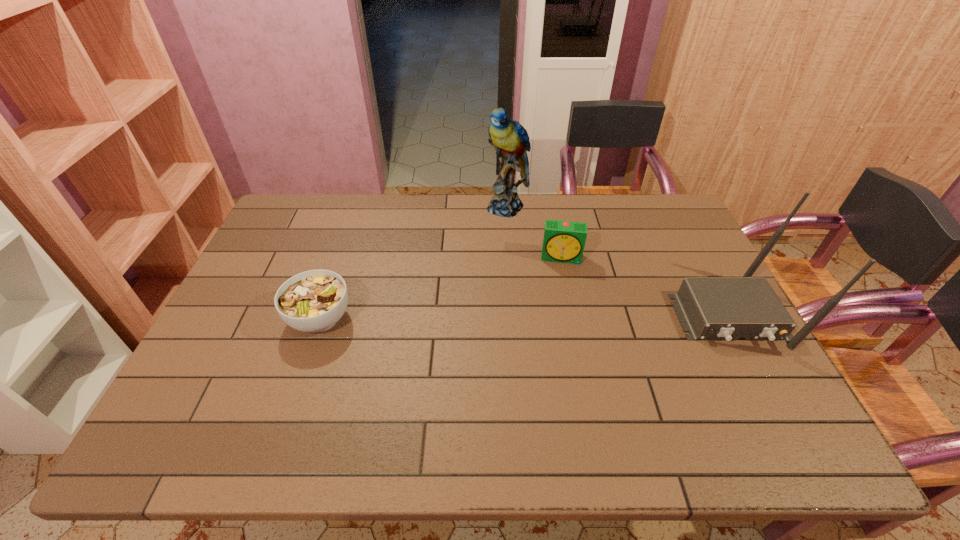
What are the coordinates of `vacant space at the left edge` in the screenshot? It's located at (264, 284).

Find the location of a particular element. The width and height of the screenshot is (960, 540). vacant region at the right edge of the desktop is located at coordinates (744, 352).

In the image, there is a desktop. Where is `vacant space at the far right corner`? vacant space at the far right corner is located at coordinates (666, 235).

The width and height of the screenshot is (960, 540). I want to click on vacant area that lies between the rightmost object and the leftmost object, so click(524, 318).

The height and width of the screenshot is (540, 960). Find the location of `free spot between the router and the parrot`. free spot between the router and the parrot is located at coordinates (618, 262).

This screenshot has width=960, height=540. What are the coordinates of `empty space between the second object from right to left and the router` in the screenshot? It's located at (645, 287).

Locate an element on the screen. The height and width of the screenshot is (540, 960). vacant area between the farthest object and the shortest object is located at coordinates (414, 263).

Locate an element on the screen. vacant area that lies between the third object from left to right and the second tallest object is located at coordinates (645, 287).

What are the coordinates of `vacant region between the farthest object and the soup bowl` in the screenshot? It's located at coord(414,263).

You are a GUI agent. You are given a task and a screenshot of the screen. Output one action in this format:
    pyautogui.click(x=<x>, y=<y>)
    Task: Click on the unoccupied position between the soup bowl and the router
    
    Given the screenshot: What is the action you would take?
    pyautogui.click(x=524, y=318)